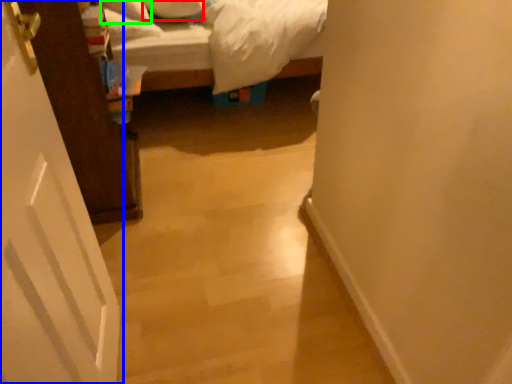
Question: Estimate the real-world distances between objects in this image. Which object is closer to pillow (highlighted by a red box), door (highlighted by a blue box) or pillow (highlighted by a green box)?

Choices:
 (A) door
 (B) pillow

Answer: (B)